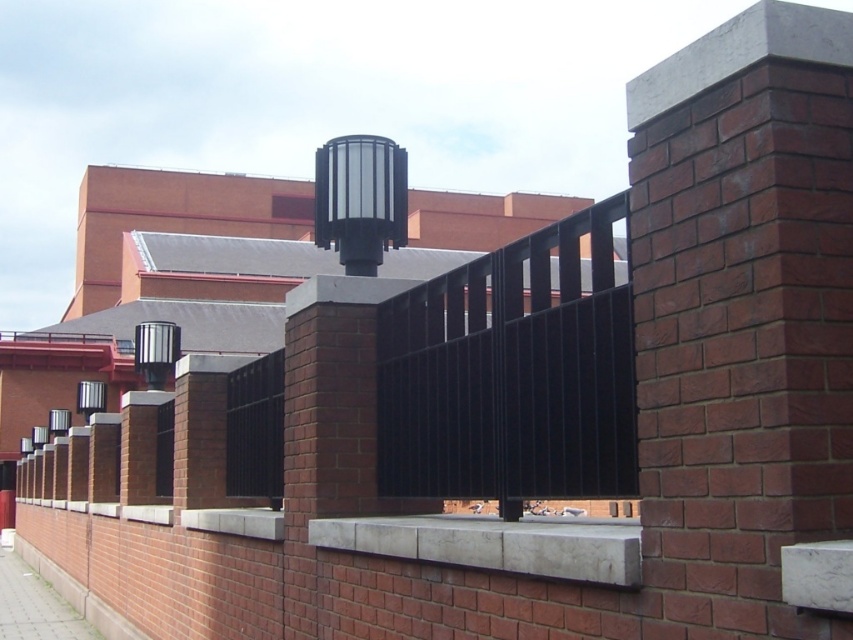
You are standing in front of the brick wall and want to install a new light fixture between the two points labeled point (607, 476) and point (566, 536). Which point should the new light be placed closer to if you want it to be closer to the front of the wall?

The new light should be placed closer to point (566, 536) because point (607, 476) is behind point (566, 536), so placing it near the latter would position it closer to the front of the wall.

You are a maintenance worker assessing the brick wall structure. You see the black metal fence at center and the smooth concrete ledge at center. Which object requires more space for maintenance access due to its size?

The black metal fence at center requires more space for maintenance access because it is larger in size than the smooth concrete ledge at center.

You are a maintenance worker needing to replace a light fixture on the black metal fence at center. The replacement part requires a 12 inch clearance between the fence and the smooth concrete ledge at center. Is there enough space for the installation?

The black metal fence at center is 14.14 inches from the smooth concrete ledge at center, which is more than the required 12 inch clearance. Therefore, there is sufficient space for the installation.